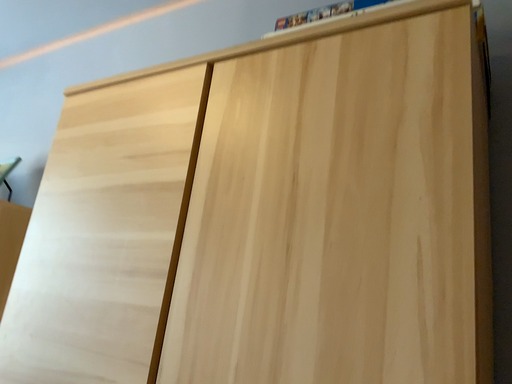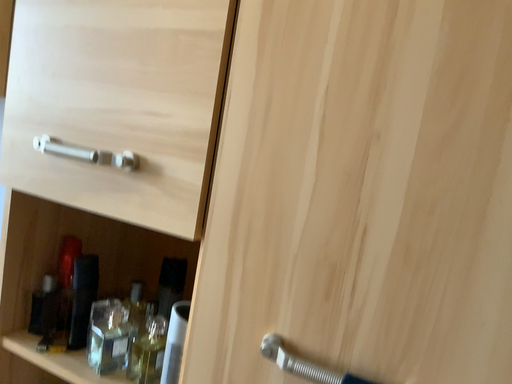
Question: Which way did the camera rotate in the video?

Choices:
 (A) rotated upward
 (B) rotated downward

Answer: (B)